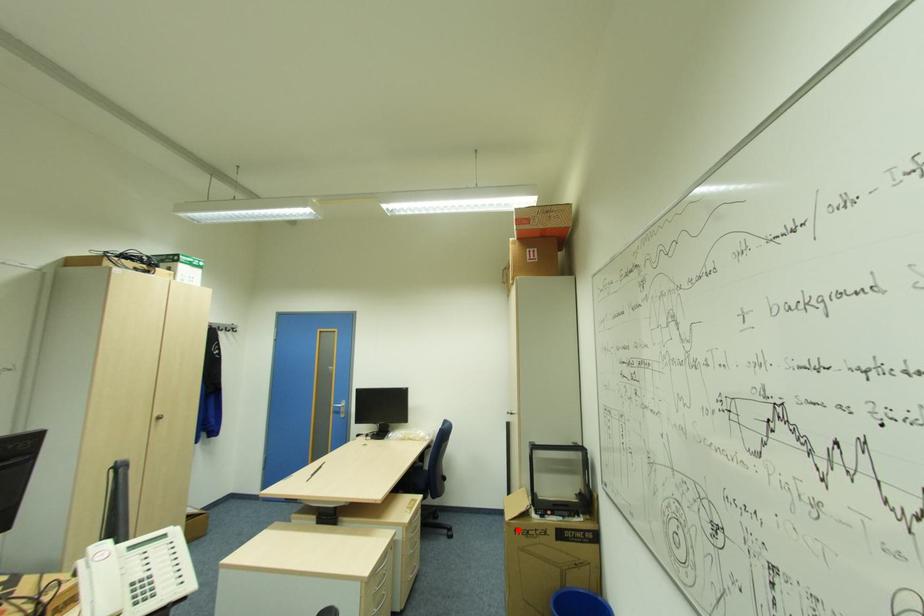
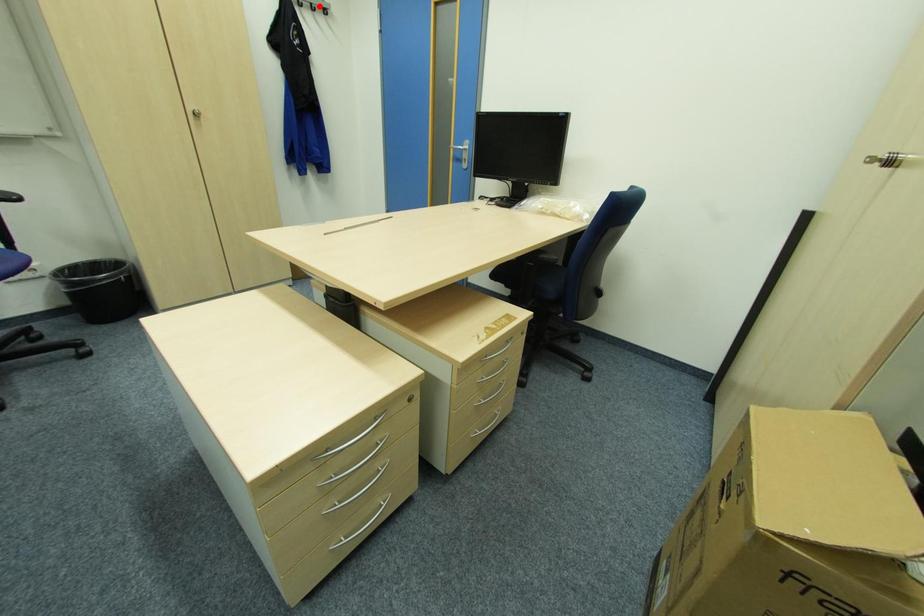
I am providing you with two images of the same scene from different viewpoints. A red point is marked on the first image and another point is marked on the second image. Is the marked point in image1 the same physical position as the marked point in image2?

No